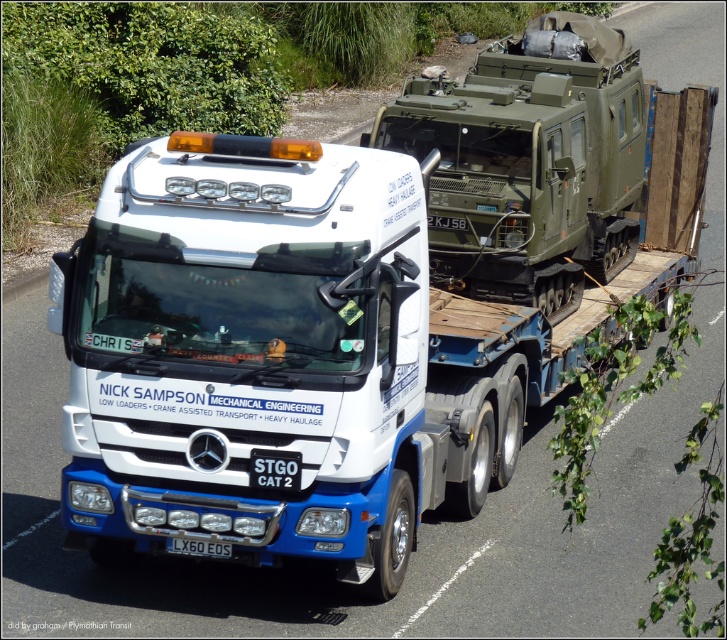
Can you confirm if white matte truck at center is wider than white plastic license plate at lower center?

Yes, white matte truck at center is wider than white plastic license plate at lower center.

What do you see at coordinates (281, 360) in the screenshot? Image resolution: width=727 pixels, height=640 pixels. I see `white matte truck at center` at bounding box center [281, 360].

At what (x,y) coordinates should I click in order to perform the action: click on white matte truck at center. Please return your answer as a coordinate pair (x, y). The width and height of the screenshot is (727, 640). Looking at the image, I should click on (281, 360).